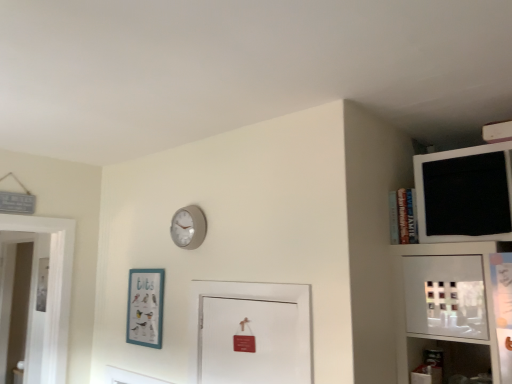
Question: Is teal matte picture frame at lower left turned away from black matte medicine cabinet at upper right?

Choices:
 (A) no
 (B) yes

Answer: (A)

Question: Considering the relative sizes of teal matte picture frame at lower left and black matte medicine cabinet at upper right in the image provided, is teal matte picture frame at lower left smaller than black matte medicine cabinet at upper right?

Choices:
 (A) yes
 (B) no

Answer: (A)

Question: Is teal matte picture frame at lower left directly adjacent to black matte medicine cabinet at upper right?

Choices:
 (A) yes
 (B) no

Answer: (B)

Question: From the image's perspective, is teal matte picture frame at lower left above black matte medicine cabinet at upper right?

Choices:
 (A) yes
 (B) no

Answer: (B)

Question: Does teal matte picture frame at lower left come in front of black matte medicine cabinet at upper right?

Choices:
 (A) yes
 (B) no

Answer: (B)

Question: Is teal matte picture frame at lower left to the left of black matte medicine cabinet at upper right from the viewer's perspective?

Choices:
 (A) no
 (B) yes

Answer: (B)

Question: Is black matte medicine cabinet at upper right not inside teal matte picture frame at lower left?

Choices:
 (A) no
 (B) yes

Answer: (B)

Question: Is black matte medicine cabinet at upper right looking in the opposite direction of teal matte picture frame at lower left?

Choices:
 (A) yes
 (B) no

Answer: (B)

Question: From a real-world perspective, is black matte medicine cabinet at upper right physically below teal matte picture frame at lower left?

Choices:
 (A) no
 (B) yes

Answer: (A)

Question: Is black matte medicine cabinet at upper right positioned far away from teal matte picture frame at lower left?

Choices:
 (A) yes
 (B) no

Answer: (A)

Question: From the image's perspective, is black matte medicine cabinet at upper right under teal matte picture frame at lower left?

Choices:
 (A) yes
 (B) no

Answer: (B)

Question: From the image's perspective, is black matte medicine cabinet at upper right over teal matte picture frame at lower left?

Choices:
 (A) no
 (B) yes

Answer: (B)

Question: Can you confirm if matte gray clock at upper center is taller than teal matte picture frame at lower left?

Choices:
 (A) no
 (B) yes

Answer: (A)